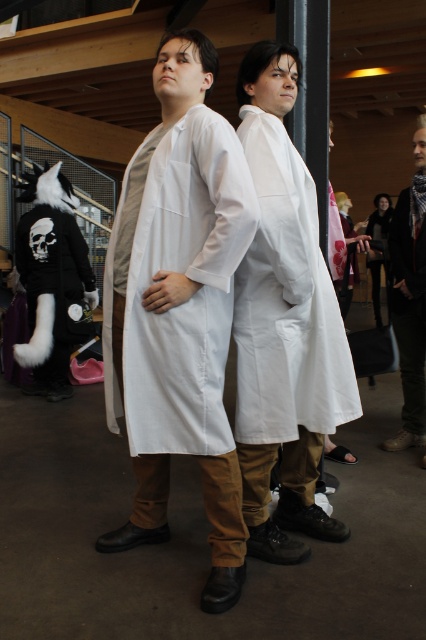
Question: Does white cotton lab coat at center have a lesser width compared to matte black coat at center?

Choices:
 (A) no
 (B) yes

Answer: (A)

Question: Which of the following is the farthest from the observer?

Choices:
 (A) dark brown leather jacket at right
 (B) white cotton lab coat at center
 (C) white matte lab coat at center
 (D) matte black coat at center

Answer: (D)

Question: Where is dark brown leather jacket at right located in relation to matte black coat at center in the image?

Choices:
 (A) below
 (B) above

Answer: (A)

Question: Considering the real-world distances, which object is farthest from the matte black coat at center?

Choices:
 (A) dark brown leather jacket at right
 (B) white matte lab coat at center
 (C) white cotton lab coat at center

Answer: (C)

Question: From the image, what is the correct spatial relationship of dark brown leather jacket at right in relation to matte black coat at center?

Choices:
 (A) below
 (B) above

Answer: (A)

Question: Which object is positioned farthest from the white matte lab coat at center?

Choices:
 (A) white cotton lab coat at center
 (B) matte black coat at center
 (C) dark brown leather jacket at right

Answer: (B)